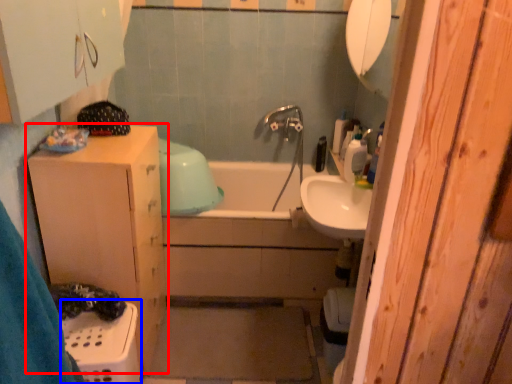
Question: Which point is further to the camera, bathroom cabinet (highlighted by a red box) or laundry basket (highlighted by a blue box)?

Choices:
 (A) bathroom cabinet
 (B) laundry basket

Answer: (A)